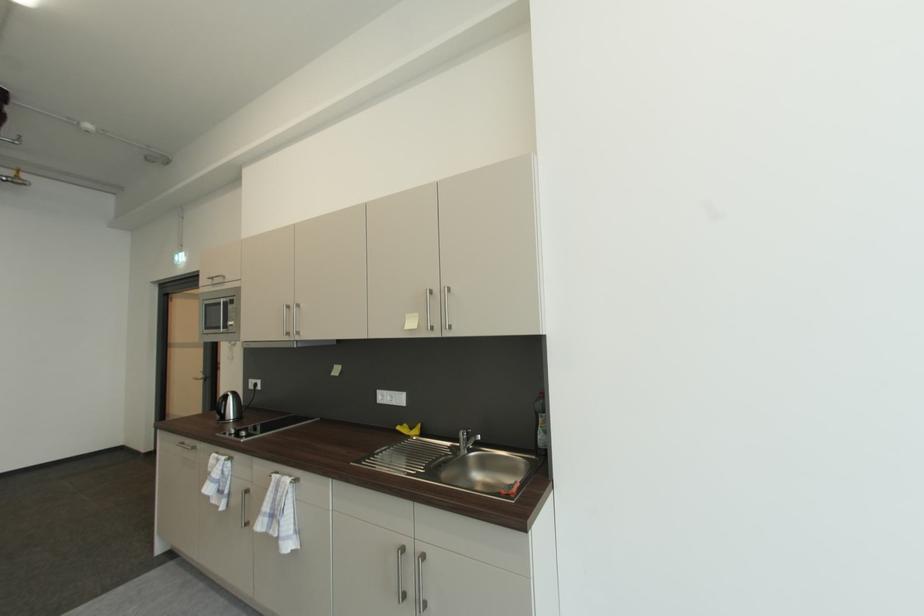
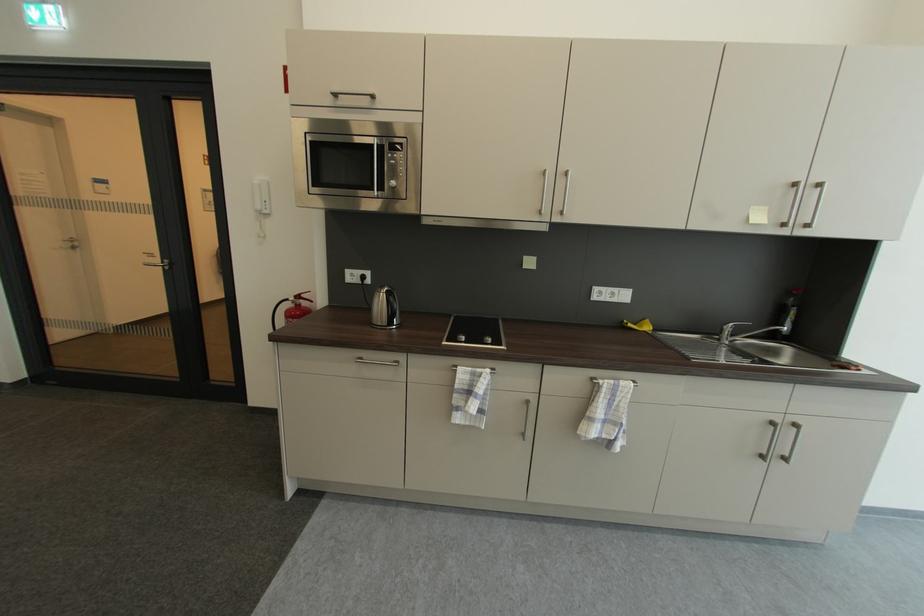
Locate, in the second image, the point that corresponds to (x=226, y=330) in the first image.

(380, 191)